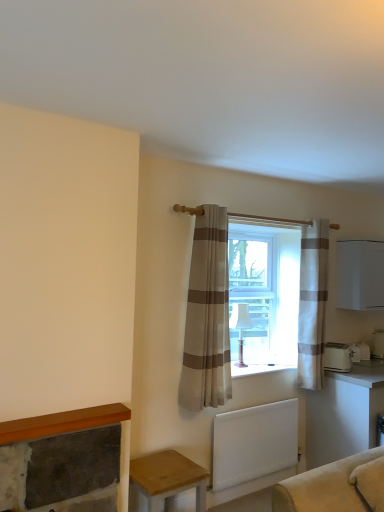
Question: Based on their positions, is white fabric lampshade at window located to the left or right of wooden table at lower left, placed as the first table when sorted from left to right?

Choices:
 (A) left
 (B) right

Answer: (B)

Question: From their relative heights in the image, would you say white fabric lampshade at window is taller or shorter than wooden table at lower left, placed as the first table when sorted from left to right?

Choices:
 (A) short
 (B) tall

Answer: (B)

Question: Which is nearer to the white matte radiator at lower center?

Choices:
 (A) white plastic toaster at right, placed as the second appliance when sorted from front to back
 (B) white striped curtain at center, the 2th curtain in the left-to-right sequence
 (C) white fabric lampshade at window
 (D) wooden table at lower left, arranged as the second table when viewed from the back
 (E) beige striped curtain at center, placed as the 2th curtain when sorted from right to left

Answer: (E)

Question: Which object is positioned farthest from the white striped curtain at center, the 2th curtain in the left-to-right sequence?

Choices:
 (A) white plastic toaster at right, placed as the second appliance when sorted from front to back
 (B) white plastic toaster at lower right, which ranks as the 1th appliance in front-to-back order
 (C) beige striped curtain at center, arranged as the first curtain when viewed from the front
 (D) white matte cabinet at right
 (E) wooden table at lower left, marked as the second table in a right-to-left arrangement

Answer: (E)